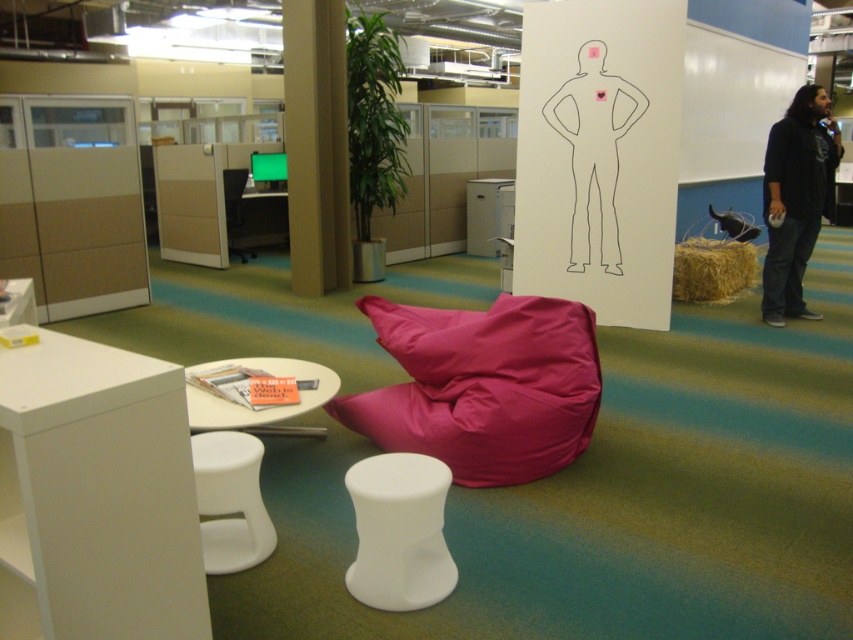
You are sitting on the pink fabric bean bag at center and want to reach the items on the white glossy table at lower left. Based on their positions, can you easily reach them without moving from the bean bag?

The white glossy table at lower left is below the pink fabric bean bag at center, so you can easily reach the items on it without moving from the bean bag.

You are a delivery person who needs to place a large box on the floor in the office. The box is 1.2 meters tall. You see the pink fabric bean bag at center and the white glossy table at center. Which object is taller than the box?

The pink fabric bean bag at center is taller than the white glossy table at center, but the box is 1.2 meters tall. Since the height of the bean bag and table are not provided, we cannot determine if either is taller than the box.